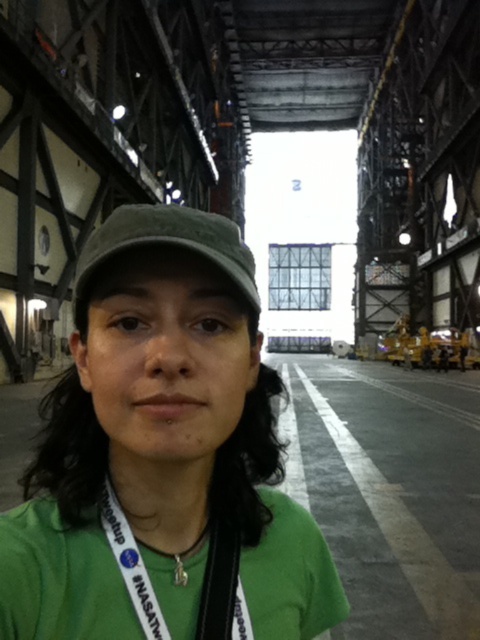
Who is more distant from viewer, (189, 452) or (120, 221)?

The point (120, 221) is behind.

Based on the photo, does green fabric at center have a greater width compared to green fabric cap at center?

Incorrect, green fabric at center's width does not surpass green fabric cap at center's.

Describe the element at coordinates (162, 483) in the screenshot. Image resolution: width=480 pixels, height=640 pixels. I see `green fabric at center` at that location.

Where is `green fabric at center`? The width and height of the screenshot is (480, 640). green fabric at center is located at coordinates (162, 483).

Can you confirm if green matte cap at center is smaller than white fabric lanyard at center?

Incorrect, green matte cap at center is not smaller in size than white fabric lanyard at center.

Which is behind, point (118, 208) or point (130, 593)?

The point (118, 208) is more distant.

Between point (232, 572) and point (128, 570), which one is positioned behind?

Point (232, 572)

What are the coordinates of `green matte cap at center` in the screenshot? It's located at (163, 456).

Who is positioned more to the left, green matte cap at center or green fabric at center?

green matte cap at center is more to the left.

Can you confirm if green matte cap at center is shorter than green fabric at center?

No, green matte cap at center is not shorter than green fabric at center.

Find the location of a particular element. green matte cap at center is located at coordinates (163, 456).